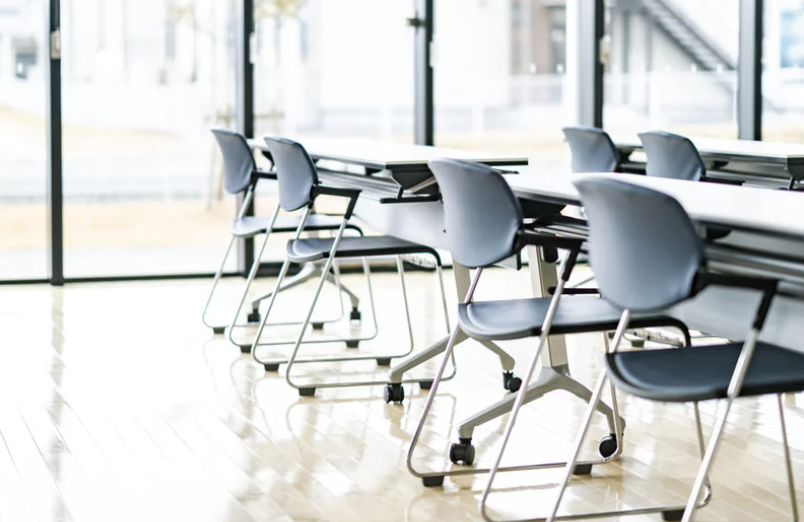
Find the location of `chair seats`. chair seats is located at coordinates (243, 227), (371, 249), (515, 318), (673, 381).